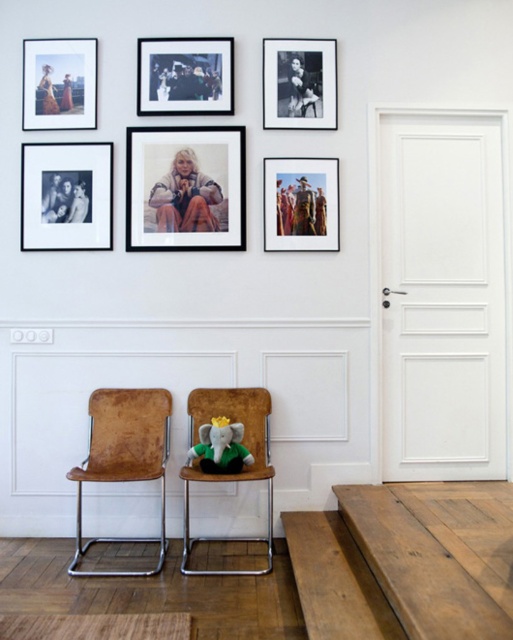
Can you confirm if matte black photo frame at center is shorter than matte paper photo at center?

Incorrect, matte black photo frame at center's height does not fall short of matte paper photo at center's.

Which is more to the right, matte black photo frame at center or matte paper photo at center?

Positioned to the right is matte paper photo at center.

Find the location of `matte black photo frame at center`. matte black photo frame at center is located at coordinates (186, 188).

Find the location of `matte black photo frame at center`. matte black photo frame at center is located at coordinates (186, 188).

Does brown leather chair at center have a smaller size compared to matte black photo frame at upper left?

No.

Can you confirm if brown leather chair at center is bigger than matte black photo frame at upper left?

Indeed, brown leather chair at center has a larger size compared to matte black photo frame at upper left.

This screenshot has height=640, width=513. What do you see at coordinates (230, 474) in the screenshot? I see `brown leather chair at center` at bounding box center [230, 474].

Find the location of `brown leather chair at center`. brown leather chair at center is located at coordinates (230, 474).

Is matte black photo frame at center thinner than black matte photo frame at upper center?

In fact, matte black photo frame at center might be wider than black matte photo frame at upper center.

Based on the photo, can you confirm if matte black photo frame at center is smaller than black matte photo frame at upper center?

Actually, matte black photo frame at center might be larger than black matte photo frame at upper center.

Identify the location of matte black photo frame at center. The height and width of the screenshot is (640, 513). (186, 188).

At what (x,y) coordinates should I click in order to perform the action: click on matte black photo frame at center. Please return your answer as a coordinate pair (x, y). The width and height of the screenshot is (513, 640). Looking at the image, I should click on (186, 188).